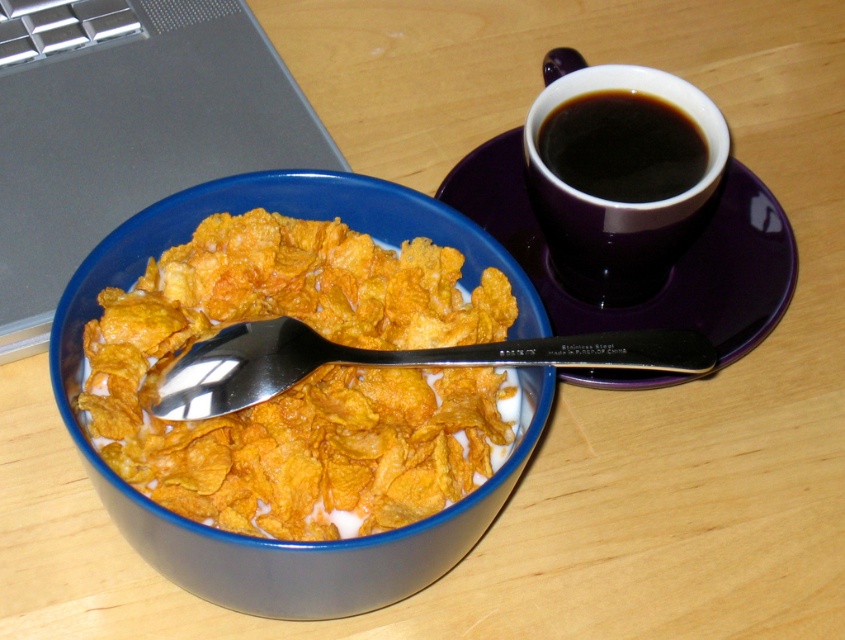
Question: Which object is positioned farthest from the silver/stainless steel spoon at center?

Choices:
 (A) black glossy cup at upper right
 (B) purple glossy plate at upper center
 (C) silver metallic laptop at upper left
 (D) black glossy mug at upper right

Answer: (C)

Question: Estimate the real-world distances between objects in this image. Which object is closer to the black glossy mug at upper right?

Choices:
 (A) purple glossy plate at upper center
 (B) silver/stainless steel spoon at center
 (C) yellow matte cereal at center

Answer: (A)

Question: Does yellow matte cereal at center appear on the left side of black glossy cup at upper right?

Choices:
 (A) no
 (B) yes

Answer: (B)

Question: From the image, what is the correct spatial relationship of purple glossy plate at upper center in relation to black glossy mug at upper right?

Choices:
 (A) above
 (B) below

Answer: (B)

Question: Which of the following is the farthest from the observer?

Choices:
 (A) silver/stainless steel spoon at center
 (B) black glossy cup at upper right
 (C) black glossy mug at upper right
 (D) purple glossy plate at upper center

Answer: (D)

Question: Does yellow matte cereal at center have a larger size compared to silver/stainless steel spoon at center?

Choices:
 (A) yes
 (B) no

Answer: (A)